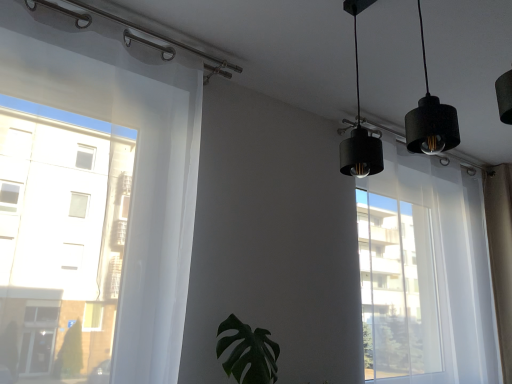
Image resolution: width=512 pixels, height=384 pixels. What do you see at coordinates (248, 353) in the screenshot?
I see `green matte leaf at center` at bounding box center [248, 353].

This screenshot has height=384, width=512. What are the coordinates of `green matte leaf at center` in the screenshot? It's located at click(248, 353).

What do you see at coordinates (425, 273) in the screenshot? I see `black matte lampshade at upper right` at bounding box center [425, 273].

Identify the location of black matte lampshade at upper right. The height and width of the screenshot is (384, 512). (425, 273).

This screenshot has width=512, height=384. What are the coordinates of `green matte leaf at center` in the screenshot? It's located at click(248, 353).

Does green matte leaf at center appear on the right side of black matte lampshade at upper right?

No.

Does green matte leaf at center come in front of black matte lampshade at upper right?

Yes, the depth of green matte leaf at center is less than that of black matte lampshade at upper right.

Which point is more forward, (249, 348) or (467, 347)?

Point (249, 348)

From the image's perspective, does green matte leaf at center appear lower than black matte lampshade at upper right?

Yes.

From a real-world perspective, is green matte leaf at center positioned under black matte lampshade at upper right based on gravity?

Indeed, from a real-world perspective, green matte leaf at center is positioned beneath black matte lampshade at upper right.

In terms of width, does green matte leaf at center look wider or thinner when compared to black matte lampshade at upper right?

In the image, green matte leaf at center appears to be wider than black matte lampshade at upper right.

Can you confirm if green matte leaf at center is shorter than black matte lampshade at upper right?

Correct, green matte leaf at center is not as tall as black matte lampshade at upper right.

Which of these two, green matte leaf at center or black matte lampshade at upper right, is smaller?

green matte leaf at center is smaller.

Is green matte leaf at center inside or outside of black matte lampshade at upper right?

green matte leaf at center is not enclosed by black matte lampshade at upper right.

Can you see green matte leaf at center touching black matte lampshade at upper right?

No.

Is green matte leaf at center looking in the opposite direction of black matte lampshade at upper right?

No, green matte leaf at center is not facing the opposite direction of black matte lampshade at upper right.

What's the angular difference between green matte leaf at center and black matte lampshade at upper right's facing directions?

7.17e-05 degrees.

Where is `houseplant located underneath the black matte lampshade at upper right (from a real-world perspective)`? Image resolution: width=512 pixels, height=384 pixels. houseplant located underneath the black matte lampshade at upper right (from a real-world perspective) is located at coordinates (248, 353).

Can you confirm if black matte lampshade at upper right is positioned to the right of green matte leaf at center?

Indeed, black matte lampshade at upper right is positioned on the right side of green matte leaf at center.

Considering the positions of objects black matte lampshade at upper right and green matte leaf at center in the image provided, who is behind, black matte lampshade at upper right or green matte leaf at center?

Positioned behind is black matte lampshade at upper right.

Which point is more forward, (455, 291) or (231, 319)?

The point (231, 319) is closer.

From the image's perspective, which one is positioned higher, black matte lampshade at upper right or green matte leaf at center?

black matte lampshade at upper right, from the image's perspective.

From a real-world perspective, is black matte lampshade at upper right above or below green matte leaf at center?

Clearly, from a real-world perspective, black matte lampshade at upper right is above green matte leaf at center.

Which of these two, black matte lampshade at upper right or green matte leaf at center, is thinner?

black matte lampshade at upper right.

Is black matte lampshade at upper right taller or shorter than green matte leaf at center?

In the image, black matte lampshade at upper right appears to be taller than green matte leaf at center.

Who is smaller, black matte lampshade at upper right or green matte leaf at center?

green matte leaf at center.

Do you think black matte lampshade at upper right is within green matte leaf at center, or outside of it?

black matte lampshade at upper right lies outside green matte leaf at center.

Is there a large distance between black matte lampshade at upper right and green matte leaf at center?

Indeed, black matte lampshade at upper right is not near green matte leaf at center.

Is black matte lampshade at upper right oriented towards green matte leaf at center?

No, black matte lampshade at upper right is not oriented towards green matte leaf at center.

Measure the distance from black matte lampshade at upper right to green matte leaf at center.

black matte lampshade at upper right is 3.30 feet away from green matte leaf at center.

Identify the location of bay window located above the green matte leaf at center (from a real-world perspective). (425, 273).

The width and height of the screenshot is (512, 384). Identify the location of houseplant below the black matte lampshade at upper right (from a real-world perspective). (248, 353).

Where is `houseplant located on the left of black matte lampshade at upper right`? houseplant located on the left of black matte lampshade at upper right is located at coordinates (248, 353).